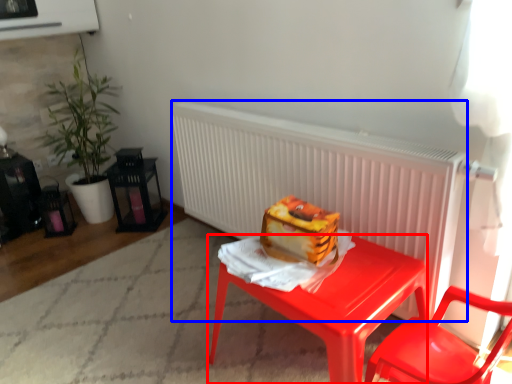
Question: Which point is further to the camera, desk (highlighted by a red box) or radiator (highlighted by a blue box)?

Choices:
 (A) desk
 (B) radiator

Answer: (B)